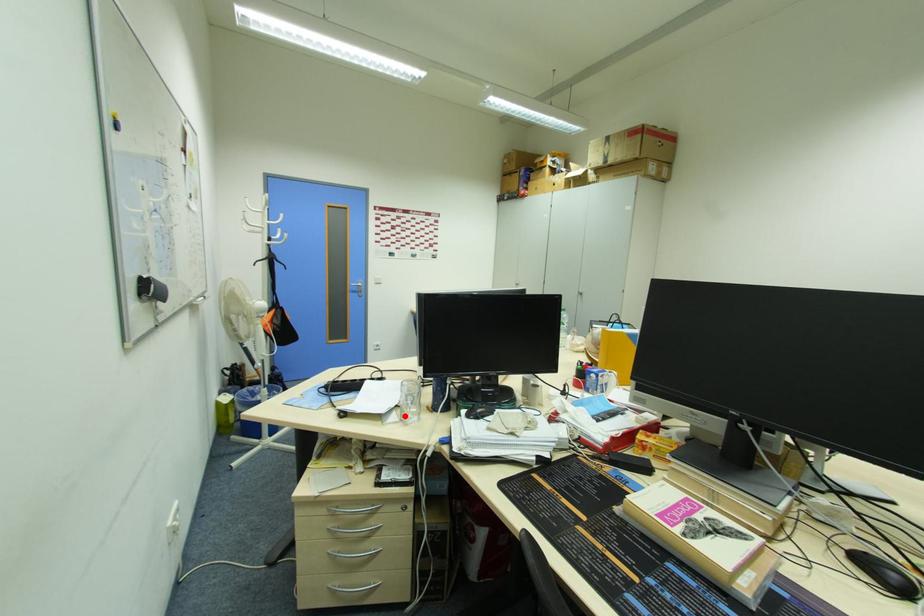
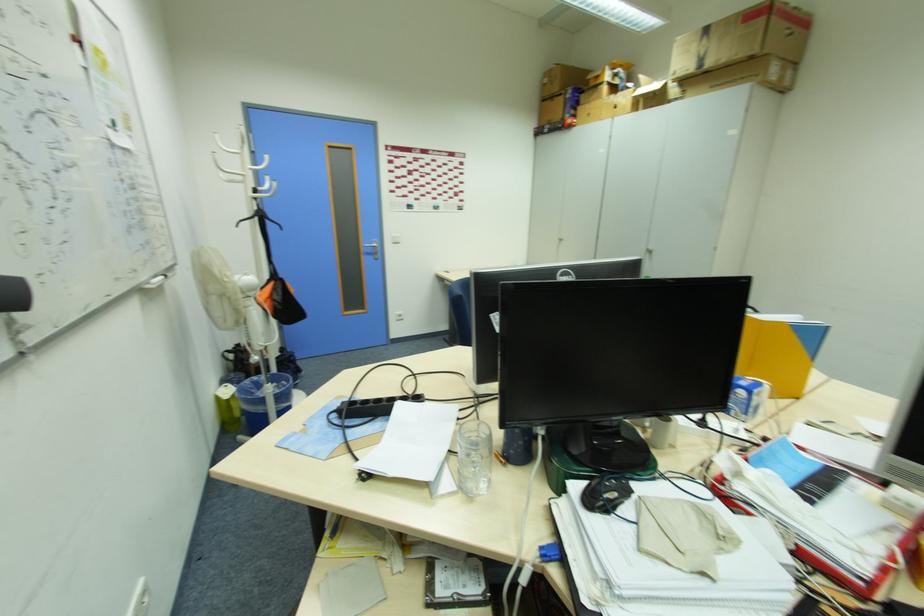
Question: I am providing you with two images of the same scene from different viewpoints. Image1 has a red point marked. In image2, the corresponding 3D location appears at what relative position? Reply with the corresponding letter.

Choices:
 (A) Closer
 (B) Farther

Answer: (A)